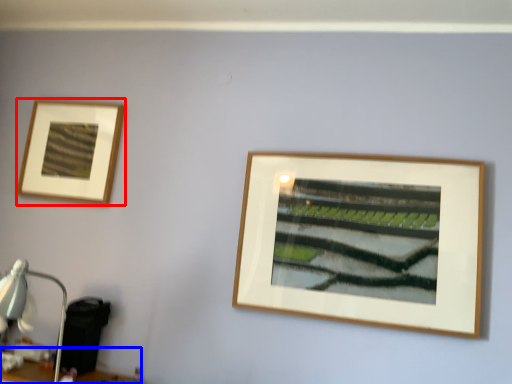
Question: Which point is closer to the camera, picture frame (highlighted by a red box) or table (highlighted by a blue box)?

Choices:
 (A) picture frame
 (B) table

Answer: (B)